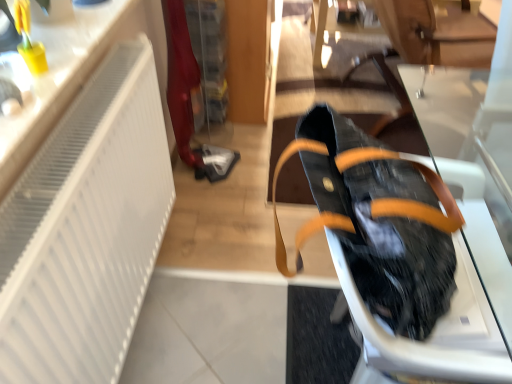
Question: Is white matte radiator at left not close to black leather bag at right?

Choices:
 (A) no
 (B) yes

Answer: (A)

Question: Is white matte radiator at left looking in the opposite direction of black leather bag at right?

Choices:
 (A) yes
 (B) no

Answer: (B)

Question: Is white matte radiator at left wider than black leather bag at right?

Choices:
 (A) yes
 (B) no

Answer: (B)

Question: Is white matte radiator at left further to camera compared to black leather bag at right?

Choices:
 (A) yes
 (B) no

Answer: (B)

Question: Is white matte radiator at left in front of black leather bag at right?

Choices:
 (A) yes
 (B) no

Answer: (A)

Question: Does white matte radiator at left appear on the right side of black leather bag at right?

Choices:
 (A) yes
 (B) no

Answer: (B)

Question: Could you tell me if black leather bag at right is facing white matte radiator at left?

Choices:
 (A) no
 (B) yes

Answer: (A)

Question: Is black leather bag at right at the left side of white matte radiator at left?

Choices:
 (A) no
 (B) yes

Answer: (A)

Question: Is white matte radiator at left completely or partially inside black leather bag at right?

Choices:
 (A) no
 (B) yes

Answer: (A)

Question: Considering the relative sizes of black leather bag at right and white matte radiator at left in the image provided, is black leather bag at right smaller than white matte radiator at left?

Choices:
 (A) no
 (B) yes

Answer: (B)

Question: Can you confirm if black leather bag at right is positioned to the right of white matte radiator at left?

Choices:
 (A) no
 (B) yes

Answer: (B)

Question: Does black leather bag at right have a greater width compared to white matte radiator at left?

Choices:
 (A) no
 (B) yes

Answer: (B)

Question: Do you think black leather bag at right is within white matte radiator at left, or outside of it?

Choices:
 (A) outside
 (B) inside

Answer: (A)